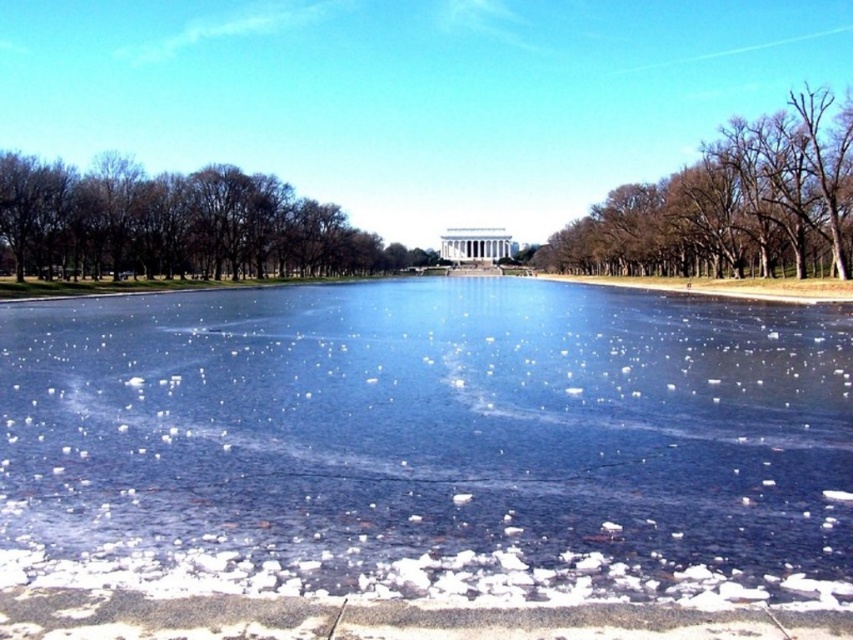
You are standing at the center of the paved area near the frozen lake. You want to take a photo of the white historical monument in the background. To avoid including the brown leafless trees at left in your photo, which direction should you move? Please provide your answer as a compass direction. The answer should be one of the following options only north, south, east, west, northeast, northwest, southeast, southwest, north, south, east, west, northeast, northwest, southeast, southwest. The answer must be

The brown leafless trees at left are located at point (177, 225). Since you are at the center of the paved area near the frozen lake, moving west would position you away from the trees, keeping them out of the frame. The answer is west.